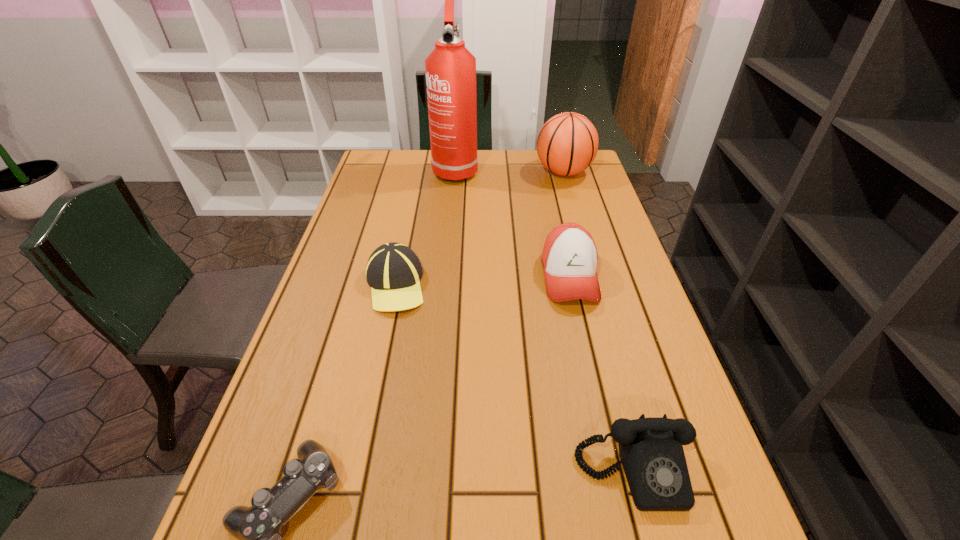
The width and height of the screenshot is (960, 540). I want to click on free space between the tallest object and the telephone, so click(x=545, y=321).

Find the location of a particular element. This screenshot has width=960, height=540. free spot between the left baseball cap and the telephone is located at coordinates (515, 379).

Find the location of a particular element. This screenshot has width=960, height=540. free space that is in between the tallest object and the second tallest object is located at coordinates (510, 170).

The width and height of the screenshot is (960, 540). Find the location of `empty location between the telephone and the fire extinguisher`. empty location between the telephone and the fire extinguisher is located at coordinates (545, 321).

The height and width of the screenshot is (540, 960). I want to click on free space between the shorter baseball cap and the telephone, so click(515, 379).

Where is `vacant space that's between the fire extinguisher and the fifth shortest object`? vacant space that's between the fire extinguisher and the fifth shortest object is located at coordinates (510, 170).

This screenshot has height=540, width=960. What are the coordinates of `unoccupied area between the shorter baseball cap and the basketball` in the screenshot? It's located at (479, 228).

The image size is (960, 540). Find the location of `empty location between the shorter baseball cap and the fire extinguisher`. empty location between the shorter baseball cap and the fire extinguisher is located at coordinates (425, 227).

Find the location of a particular element. free space between the basketball and the tallest object is located at coordinates (510, 170).

Identify which object is the closest to the basketball. Please provide its 2D coordinates. Your answer should be formatted as a tuple, i.e. [(x, y)], where the tuple contains the x and y coordinates of a point satisfying the conditions above.

[(450, 68)]